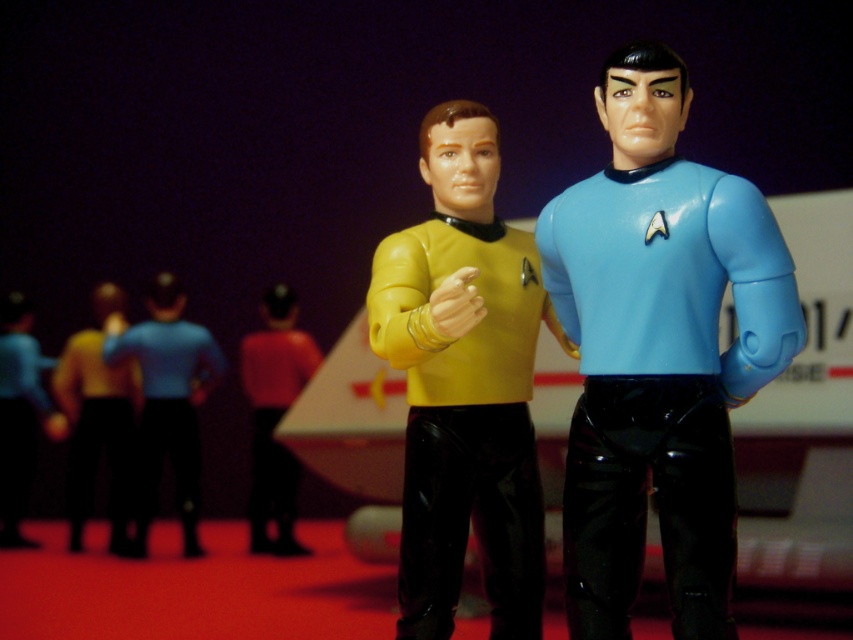
Is point (703, 518) positioned before point (109, 332)?

Yes, point (703, 518) is in front of point (109, 332).

Is blue glossy uniform at center to the left of matte blue uniform at center from the viewer's perspective?

In fact, blue glossy uniform at center is to the right of matte blue uniform at center.

Does point (587, 198) come closer to viewer compared to point (103, 346)?

Yes, it is.

Identify the location of blue glossy uniform at center. The image size is (853, 640). (659, 352).

Between matte black uniform at center and matte red uniform at center, which one has more height?

Standing taller between the two is matte red uniform at center.

Between matte black uniform at center and matte red uniform at center, which one has less height?

matte black uniform at center is shorter.

Is point (125, 444) closer to viewer compared to point (257, 403)?

No, (125, 444) is further to viewer.

The image size is (853, 640). Find the location of `matte black uniform at center`. matte black uniform at center is located at coordinates (97, 419).

Is matte blue uniform at center closer to camera compared to matte black figure at center?

Yes, matte blue uniform at center is closer to the viewer.

Does matte blue uniform at center appear over matte black figure at center?

Yes, matte blue uniform at center is above matte black figure at center.

At what (x,y) coordinates should I click in order to perform the action: click on matte blue uniform at center. Please return your answer as a coordinate pair (x, y). Looking at the image, I should click on (167, 401).